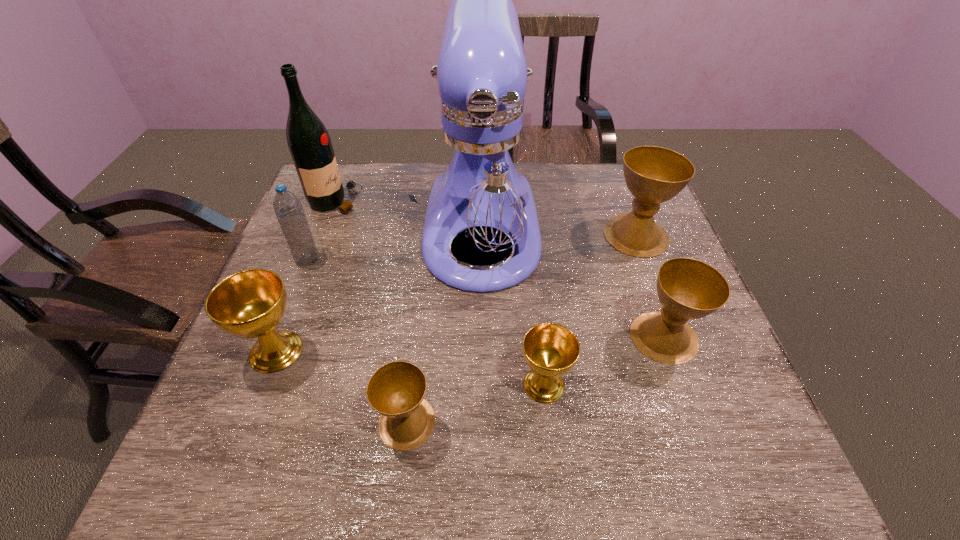
Locate an element on the screen. The height and width of the screenshot is (540, 960). vacant area at the near edge of the desktop is located at coordinates (414, 454).

I want to click on vacant space at the left edge of the desktop, so click(x=308, y=360).

Where is `free region at the right edge`? The image size is (960, 540). free region at the right edge is located at coordinates (643, 268).

You are a GUI agent. You are given a task and a screenshot of the screen. Output one action in this format:
    pyautogui.click(x=<x>, y=<y>)
    Task: Click on the vacant space at the far left corner
    
    Given the screenshot: What is the action you would take?
    pyautogui.click(x=349, y=173)

Where is `free spot at the near left corner of the desktop`? free spot at the near left corner of the desktop is located at coordinates (193, 445).

Where is `vacant area that lies between the fourth chalice from right to left and the seventh shortest object`? vacant area that lies between the fourth chalice from right to left and the seventh shortest object is located at coordinates (372, 312).

Identify the location of vacant region between the second nearest brown chalice and the left gold chalice. This screenshot has width=960, height=540. pyautogui.click(x=470, y=344).

Identify the location of unoccupied area between the wine bottle and the right gold chalice. (440, 293).

Where is `vacant point located between the tallest object and the water bottle`? The height and width of the screenshot is (540, 960). vacant point located between the tallest object and the water bottle is located at coordinates (395, 245).

Find the location of a particular element. Image resolution: width=960 pixels, height=540 pixels. free space between the green wine bottle and the mixer is located at coordinates (409, 215).